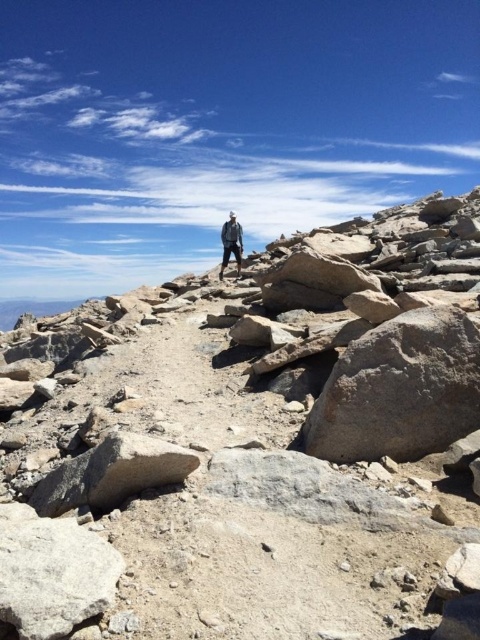
Question: Does gray rock at center have a larger size compared to denim jacket at center?

Choices:
 (A) yes
 (B) no

Answer: (B)

Question: Which object is farther from the camera taking this photo?

Choices:
 (A) gray rock at center
 (B) denim jacket at center

Answer: (B)

Question: Is gray rock at center below denim jacket at center?

Choices:
 (A) no
 (B) yes

Answer: (B)

Question: Is gray rock at center above denim jacket at center?

Choices:
 (A) no
 (B) yes

Answer: (A)

Question: Which point appears closest to the camera in this image?

Choices:
 (A) (224, 264)
 (B) (44, 429)

Answer: (B)